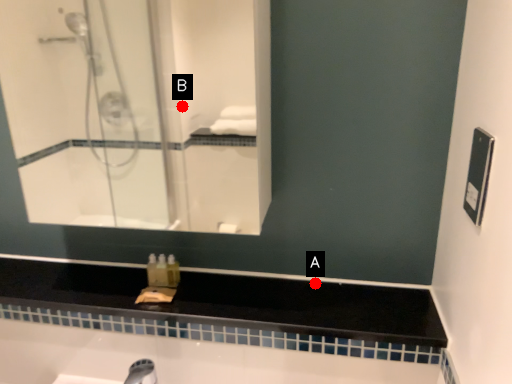
Question: Two points are circled on the image, labeled by A and B beside each circle. Which of the following is the farthest from the observer?

Choices:
 (A) A is further
 (B) B is further

Answer: (B)